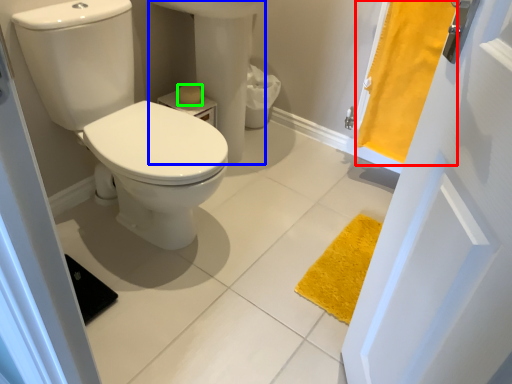
Question: Estimate the real-world distances between objects in this image. Which object is farther from curtain (highlighted by a red box), sink (highlighted by a blue box) or toilet paper (highlighted by a green box)?

Choices:
 (A) sink
 (B) toilet paper

Answer: (B)